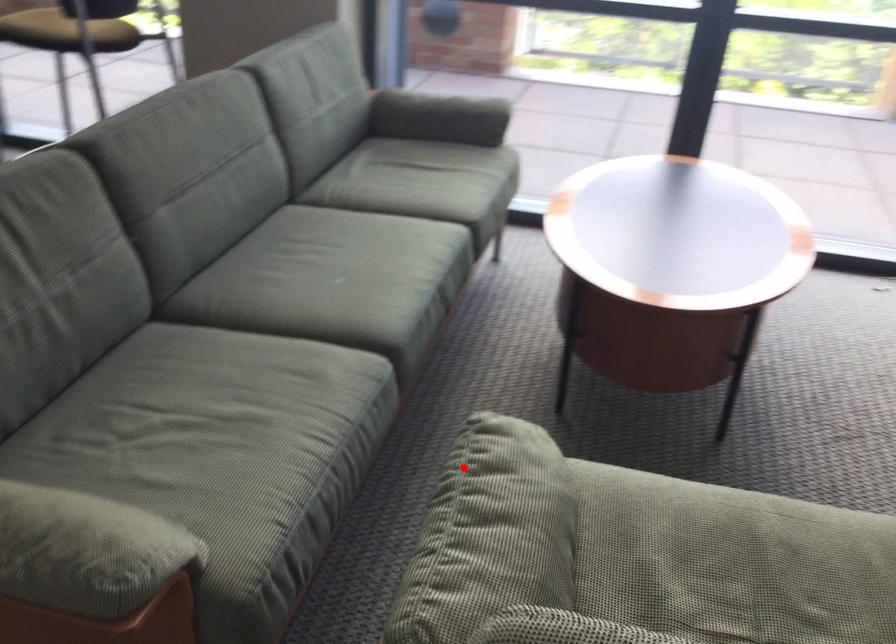
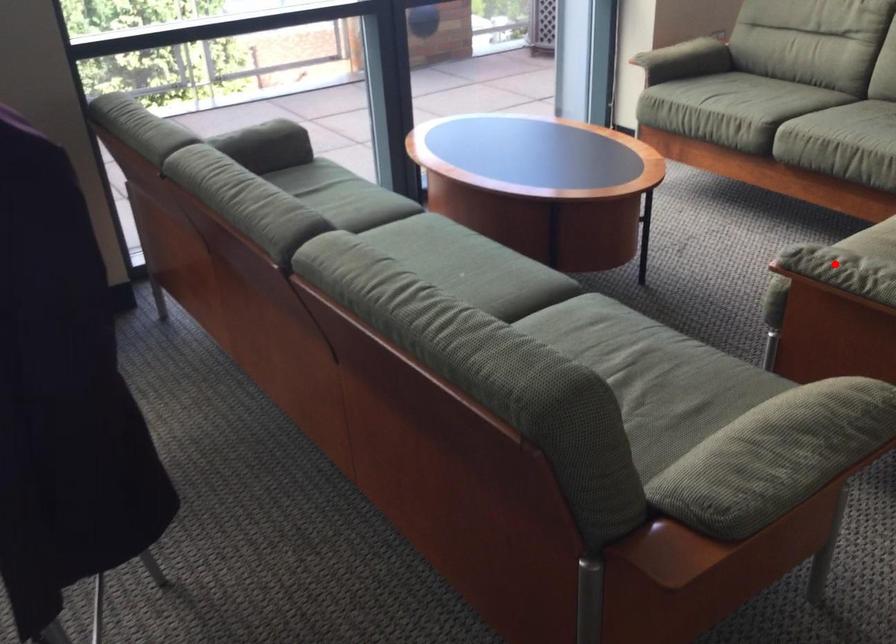
I am providing you with two images of the same scene from different viewpoints. A red point is marked on the first image and another point is marked on the second image. Does the point marked in image1 correspond to the same location as the one in image2?

Yes